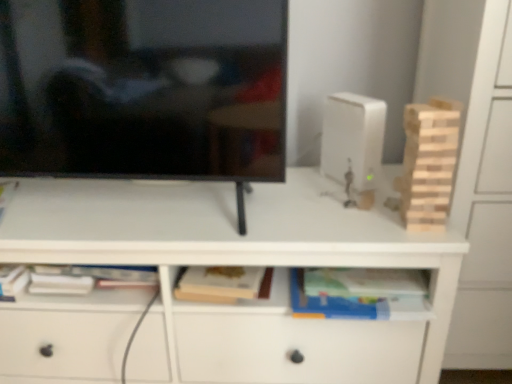
Question: Is hardcover book at center taller or shorter than black glossy television at upper left?

Choices:
 (A) tall
 (B) short

Answer: (B)

Question: From the image's perspective, relative to black glossy television at upper left, is hardcover book at center above or below?

Choices:
 (A) below
 (B) above

Answer: (A)

Question: Which object is the closest to the black glossy television at upper left?

Choices:
 (A) hardcover book at center
 (B) wooden tower at right
 (C) light wood block tower at right
 (D) white matte desk at center

Answer: (D)

Question: Considering the real-world distances, which object is farthest from the hardcover book at center?

Choices:
 (A) white matte desk at center
 (B) black glossy television at upper left
 (C) wooden tower at right
 (D) light wood block tower at right

Answer: (B)